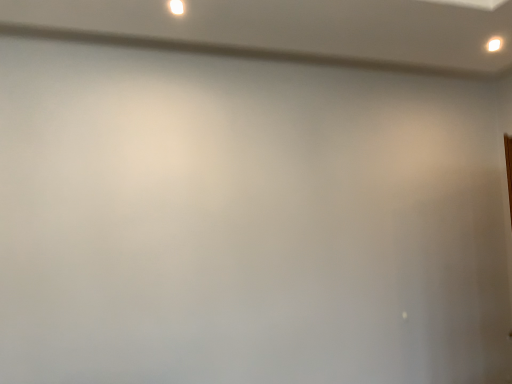
This screenshot has width=512, height=384. What do you see at coordinates (176, 7) in the screenshot?
I see `white glossy light at upper center, the second light viewed from the right` at bounding box center [176, 7].

You are a GUI agent. You are given a task and a screenshot of the screen. Output one action in this format:
    pyautogui.click(x=<x>, y=<y>)
    Task: Click on the white glossy light at upper center, which is counted as the first light, starting from the front
    
    Given the screenshot: What is the action you would take?
    click(176, 7)

Describe the element at coordinates (494, 44) in the screenshot. I see `white glossy light at upper right, the first light positioned from the back` at that location.

At what (x,y) coordinates should I click in order to perform the action: click on white glossy light at upper right, which ranks as the 2th light in left-to-right order. Please return your answer as a coordinate pair (x, y). Looking at the image, I should click on (494, 44).

Locate an element on the screen. Image resolution: width=512 pixels, height=384 pixels. white glossy light at upper center, which is counted as the first light, starting from the front is located at coordinates (176, 7).

Is white glossy light at upper center, the second light viewed from the right, at the left side of white glossy light at upper right, which ranks as the 2th light in left-to-right order?

Yes.

Is the depth of white glossy light at upper center, placed as the 2th light when sorted from back to front, less than that of white glossy light at upper right, which ranks as the 2th light in left-to-right order?

That is True.

Considering the positions of point (180, 12) and point (500, 45), is point (180, 12) closer or farther from the camera than point (500, 45)?

Point (180, 12) appears to be closer to the viewer than point (500, 45).

Based on the photo, from the image's perspective, is white glossy light at upper center, the second light viewed from the right, on top of white glossy light at upper right, the first light from the right?

Yes, from the image's perspective, white glossy light at upper center, the second light viewed from the right, is above white glossy light at upper right, the first light from the right.

From a real-world perspective, is white glossy light at upper center, which is counted as the first light, starting from the front, under white glossy light at upper right, the first light from the right?

Incorrect, from a real-world perspective, white glossy light at upper center, which is counted as the first light, starting from the front, is higher than white glossy light at upper right, the first light from the right.

Considering the sizes of objects white glossy light at upper center, placed as the 2th light when sorted from back to front, and white glossy light at upper right, which appears as the second light when viewed from the front, in the image provided, who is thinner, white glossy light at upper center, placed as the 2th light when sorted from back to front, or white glossy light at upper right, which appears as the second light when viewed from the front,?

With smaller width is white glossy light at upper right, which appears as the second light when viewed from the front.

Considering the sizes of white glossy light at upper center, which is counted as the first light, starting from the front, and white glossy light at upper right, the first light positioned from the back, in the image, is white glossy light at upper center, which is counted as the first light, starting from the front, taller or shorter than white glossy light at upper right, the first light positioned from the back,?

Clearly, white glossy light at upper center, which is counted as the first light, starting from the front, is shorter compared to white glossy light at upper right, the first light positioned from the back.

Who is smaller, white glossy light at upper center, the second light viewed from the right, or white glossy light at upper right, which appears as the second light when viewed from the front?

white glossy light at upper center, the second light viewed from the right.

Is white glossy light at upper center, the second light viewed from the right, positioned beyond the bounds of white glossy light at upper right, which appears as the second light when viewed from the front?

white glossy light at upper center, the second light viewed from the right, is positioned outside white glossy light at upper right, which appears as the second light when viewed from the front.

Is white glossy light at upper center, the second light viewed from the right, not near white glossy light at upper right, the first light positioned from the back?

white glossy light at upper center, the second light viewed from the right, is far away from white glossy light at upper right, the first light positioned from the back.

Is white glossy light at upper center, which appears as the first light when viewed from the left, positioned with its back to white glossy light at upper right, the first light positioned from the back?

No, white glossy light at upper center, which appears as the first light when viewed from the left, is not facing the opposite direction of white glossy light at upper right, the first light positioned from the back.

Find the location of a particular element. light on the right of white glossy light at upper center, placed as the 2th light when sorted from back to front is located at coordinates (494, 44).

Which object is positioned more to the left, white glossy light at upper right, the first light positioned from the back, or white glossy light at upper center, placed as the 2th light when sorted from back to front?

white glossy light at upper center, placed as the 2th light when sorted from back to front, is more to the left.

Is white glossy light at upper right, the first light positioned from the back, positioned before white glossy light at upper center, which appears as the first light when viewed from the left?

No, white glossy light at upper right, the first light positioned from the back, is further to the viewer.

Considering the points (501, 40) and (177, 2), which point is behind, point (501, 40) or point (177, 2)?

Point (501, 40)

From the image's perspective, which is above, white glossy light at upper right, which ranks as the 2th light in left-to-right order, or white glossy light at upper center, the second light viewed from the right?

white glossy light at upper center, the second light viewed from the right.

Looking at this image, from a real-world perspective, is white glossy light at upper right, the first light positioned from the back, positioned under white glossy light at upper center, which appears as the first light when viewed from the left, based on gravity?

Correct, in the physical world, white glossy light at upper right, the first light positioned from the back, is lower than white glossy light at upper center, which appears as the first light when viewed from the left.

Considering the sizes of objects white glossy light at upper right, the first light from the right, and white glossy light at upper center, the second light viewed from the right, in the image provided, who is thinner, white glossy light at upper right, the first light from the right, or white glossy light at upper center, the second light viewed from the right,?

Thinner between the two is white glossy light at upper right, the first light from the right.

From their relative heights in the image, would you say white glossy light at upper right, the first light from the right, is taller or shorter than white glossy light at upper center, which is counted as the first light, starting from the front?

Considering their sizes, white glossy light at upper right, the first light from the right, has more height than white glossy light at upper center, which is counted as the first light, starting from the front.

Considering the sizes of objects white glossy light at upper right, which appears as the second light when viewed from the front, and white glossy light at upper center, the second light viewed from the right, in the image provided, who is bigger, white glossy light at upper right, which appears as the second light when viewed from the front, or white glossy light at upper center, the second light viewed from the right,?

white glossy light at upper right, which appears as the second light when viewed from the front.

Does white glossy light at upper right, the first light positioned from the back, contain white glossy light at upper center, which appears as the first light when viewed from the left?

No, white glossy light at upper center, which appears as the first light when viewed from the left, is not inside white glossy light at upper right, the first light positioned from the back.

Is white glossy light at upper right, the first light positioned from the back, far from white glossy light at upper center, which is counted as the first light, starting from the front?

Yes.

Is white glossy light at upper right, the first light from the right, facing towards white glossy light at upper center, the second light viewed from the right?

No, white glossy light at upper right, the first light from the right, is not turned towards white glossy light at upper center, the second light viewed from the right.

Where is `light lying above the white glossy light at upper right, the first light from the right (from the image's perspective)`? This screenshot has height=384, width=512. light lying above the white glossy light at upper right, the first light from the right (from the image's perspective) is located at coordinates (176, 7).

There is a white glossy light at upper right, which appears as the second light when viewed from the front. Identify the location of light above it (from a real-world perspective). This screenshot has width=512, height=384. (176, 7).

Locate an element on the screen. light located above the white glossy light at upper right, the first light from the right (from the image's perspective) is located at coordinates (176, 7).